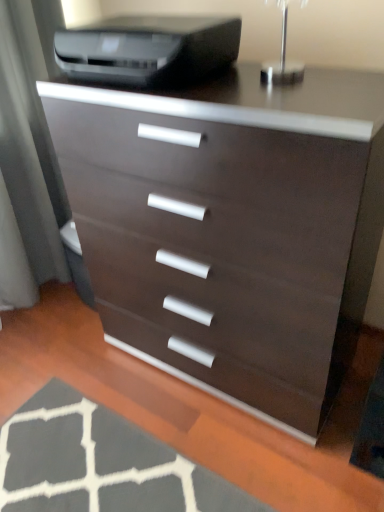
This screenshot has width=384, height=512. Identify the location of free location in front of matte brown chest of drawers at center. (214, 458).